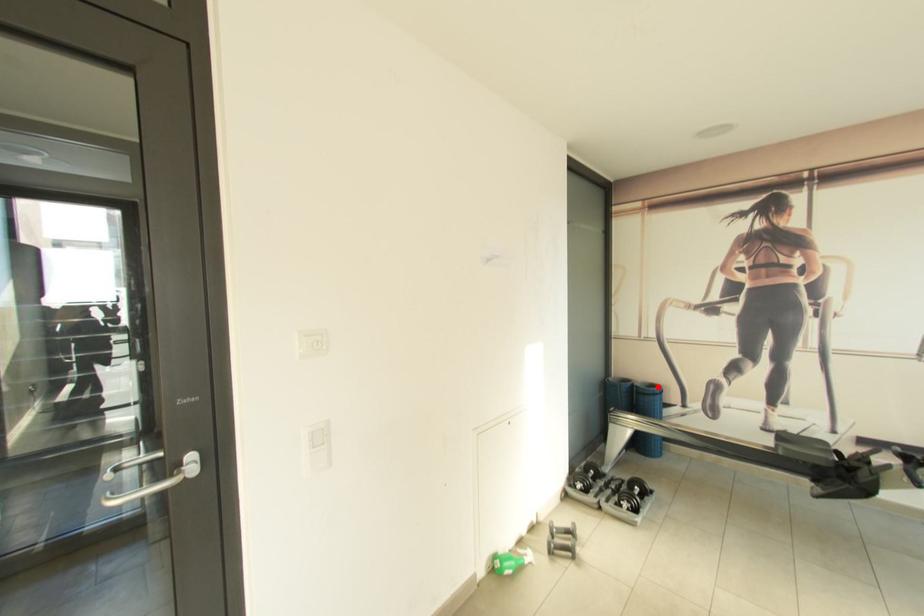
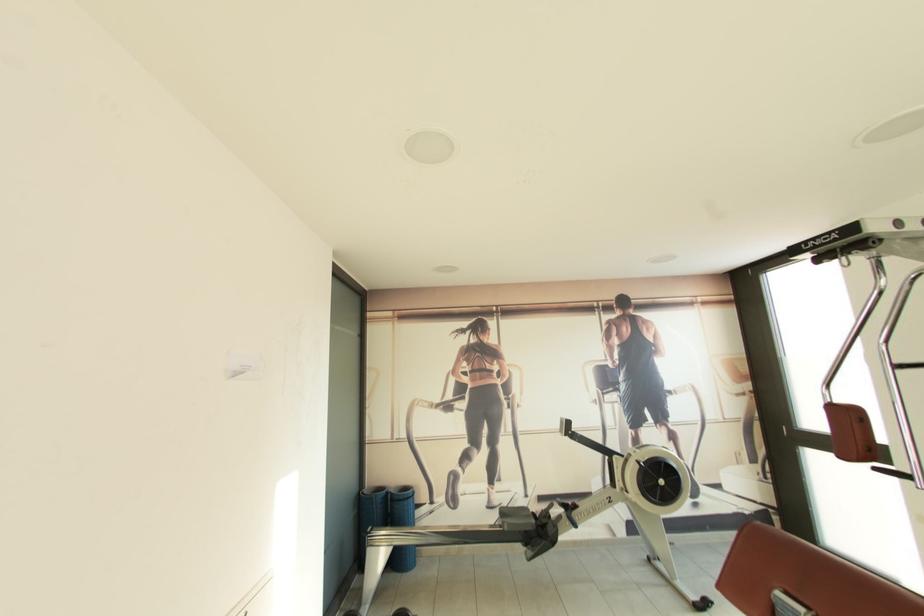
The point at the highlighted location is marked in the first image. Where is the corresponding point in the second image?

(410, 490)